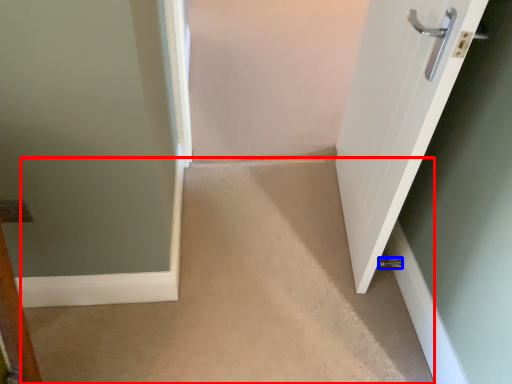
Question: Which point is further to the camera, corridor (highlighted by a red box) or door handle (highlighted by a blue box)?

Choices:
 (A) corridor
 (B) door handle

Answer: (B)